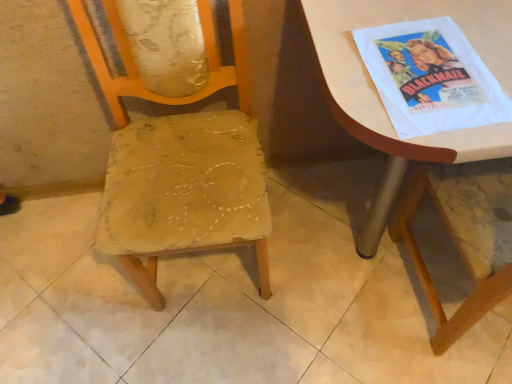
At what (x,y) coordinates should I click in order to perform the action: click on vacant space underneath worn fabric chair at center (from a real-world perspective). Please return your answer as a coordinate pair (x, y). The width and height of the screenshot is (512, 384). Looking at the image, I should click on (204, 277).